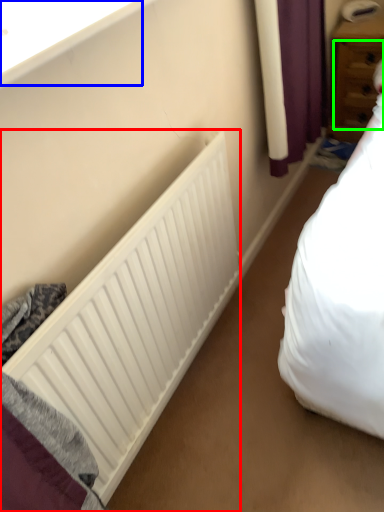
Question: Which object is the farthest from radiator (highlighted by a red box)? Choose among these: window sill (highlighted by a blue box) or drawer (highlighted by a green box).

Choices:
 (A) window sill
 (B) drawer

Answer: (B)